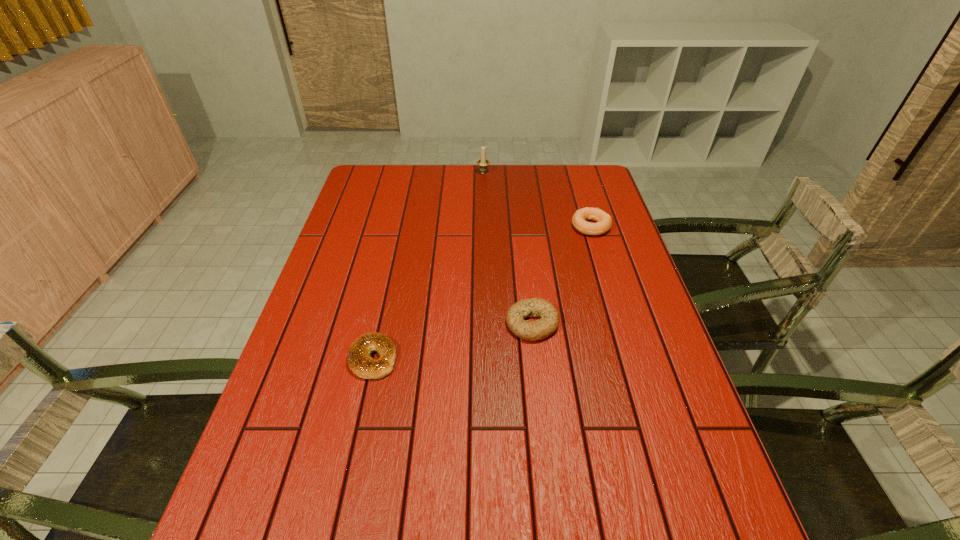
Locate an element on the screen. The height and width of the screenshot is (540, 960). vacant region between the leftmost bagel and the farthest object is located at coordinates (428, 265).

Identify the location of free area in between the rightmost bagel and the leftmost object. (482, 293).

Locate an element on the screen. The height and width of the screenshot is (540, 960). vacant point located between the farthest object and the second bagel from right to left is located at coordinates (508, 248).

The width and height of the screenshot is (960, 540). I want to click on free space between the second object from left to right and the rightmost object, so click(x=537, y=199).

Identify the location of free spot between the farthest bagel and the candle_holder. The image size is (960, 540). (537, 199).

Where is `empty space between the leftmost object and the second object from left to right`? This screenshot has width=960, height=540. empty space between the leftmost object and the second object from left to right is located at coordinates (428, 265).

Where is `vacant space in between the second bagel from left to right and the third object from right to left`? This screenshot has width=960, height=540. vacant space in between the second bagel from left to right and the third object from right to left is located at coordinates (508, 248).

Locate an element on the screen. This screenshot has height=540, width=960. object that is the second closest to the second object from left to right is located at coordinates (540, 329).

Find the location of a particular element. The height and width of the screenshot is (540, 960). the second closest object to the second bagel from left to right is located at coordinates (604, 221).

Find the location of `the second closest bagel to the farthest bagel`. the second closest bagel to the farthest bagel is located at coordinates (359, 361).